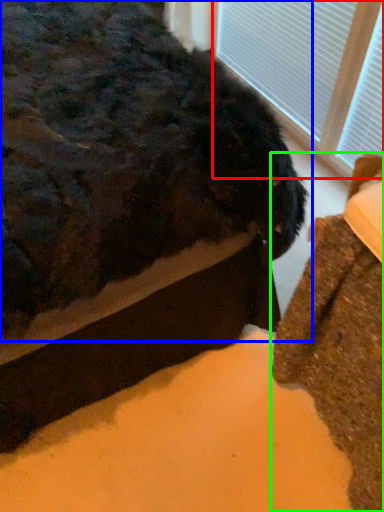
Question: Which object is the farthest from bay window (highlighted by a red box)? Choose among these: animal (highlighted by a blue box) or furniture (highlighted by a green box).

Choices:
 (A) animal
 (B) furniture

Answer: (B)